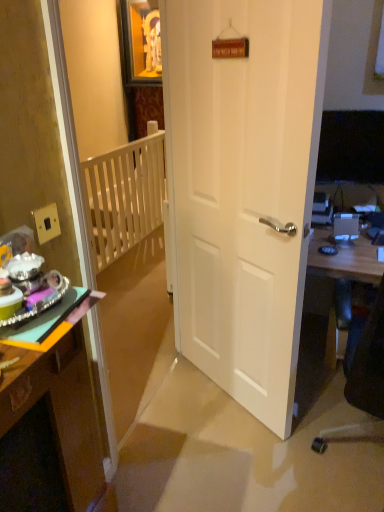
You are a GUI agent. You are given a task and a screenshot of the screen. Output one action in this format:
    pyautogui.click(x=<x>, y=<y>)
    Task: Click on the white matte door at center
    
    Given the screenshot: What is the action you would take?
    pyautogui.click(x=243, y=188)

Find the location of `wooden desk at left`. wooden desk at left is located at coordinates (60, 403).

Describe the element at coordinates (129, 263) in the screenshot. I see `white wooden bunk bed at upper left` at that location.

The image size is (384, 512). In order to click on white matte door at center in this screenshot , I will do `click(243, 188)`.

Does white wooden bunk bed at upper left come in front of white matte door at center?

That is True.

From the image's perspective, is white wooden bunk bed at upper left located above or below white matte door at center?

Clearly, from the image's perspective, white wooden bunk bed at upper left is below white matte door at center.

Is white matte door at center located within white wooden bunk bed at upper left?

Actually, white matte door at center is outside white wooden bunk bed at upper left.

I want to click on door behind the white wooden bunk bed at upper left, so tap(243, 188).

Consider the image. Is white matte door at center to the right of wooden desk at right from the viewer's perspective?

No.

Is white matte door at center looking in the opposite direction of wooden desk at right?

Correct, white matte door at center is looking away from wooden desk at right.

Who is taller, white matte door at center or wooden desk at right?

Standing taller between the two is white matte door at center.

In the image, is white matte door at center positioned in front of or behind wooden desk at right?

white matte door at center is in front of wooden desk at right.

Is wooden desk at right positioned with its back to white matte door at center?

No, white matte door at center is not at the back of wooden desk at right.

The width and height of the screenshot is (384, 512). In order to click on door above the wooden desk at right (from a real-world perspective) in this screenshot , I will do `click(243, 188)`.

Does wooden desk at right lie in front of white matte door at center?

That is False.

Does white wooden bunk bed at upper left lie behind wooden desk at left?

Yes, white wooden bunk bed at upper left is further from the viewer.

The width and height of the screenshot is (384, 512). Find the location of `bunk bed above the wooden desk at left (from a real-world perspective)`. bunk bed above the wooden desk at left (from a real-world perspective) is located at coordinates (129, 263).

Is white wooden bunk bed at upper left far from wooden desk at left?

Yes.

Does white wooden balustrade at left touch white matte door at center?

white wooden balustrade at left is not next to white matte door at center, and they're not touching.

Is white wooden balustrade at left in front of or behind white matte door at center in the image?

white wooden balustrade at left is positioned farther from the viewer than white matte door at center.

From the picture: From a real-world perspective, which is physically below, wooden desk at left or white wooden balustrade at left?

white wooden balustrade at left is physically lower.

Is wooden desk at left turned away from white wooden balustrade at left?

That's not correct — wooden desk at left is not looking away from white wooden balustrade at left.

Which is closer, (83, 503) or (156, 222)?

Clearly, point (83, 503) is closer to the camera than point (156, 222).

Is wooden desk at left placed right next to white wooden balustrade at left?

No, wooden desk at left is not in contact with white wooden balustrade at left.

Considering the relative sizes of white wooden balustrade at left and wooden desk at right in the image provided, is white wooden balustrade at left smaller than wooden desk at right?

Yes, white wooden balustrade at left is smaller than wooden desk at right.

Based on the photo, is the position of white wooden balustrade at left more distant than that of wooden desk at right?

That is True.

Does white wooden balustrade at left have a lesser height compared to wooden desk at right?

No, white wooden balustrade at left is not shorter than wooden desk at right.

Considering the relative sizes of white wooden balustrade at left and wooden desk at right in the image provided, is white wooden balustrade at left wider than wooden desk at right?

No, white wooden balustrade at left is not wider than wooden desk at right.

Find the location of a particular element. bunk bed lying on the left of white matte door at center is located at coordinates (129, 263).

Locate an element on the screen. table on the right of white matte door at center is located at coordinates (345, 259).

From the image, which object appears to be nearer to white matte door at center, white wooden bunk bed at upper left or wooden desk at right?

Among the two, wooden desk at right is located nearer to white matte door at center.

When comparing their distances from wooden desk at right, does white wooden bunk bed at upper left or white matte door at center seem closer?

Based on the image, white matte door at center appears to be nearer to wooden desk at right.

When comparing their distances from white wooden bunk bed at upper left, does white wooden balustrade at left or wooden desk at left seem closer?

white wooden balustrade at left.

Looking at the image, which one is located further to white matte door at center, wooden desk at left or white wooden bunk bed at upper left?

white wooden bunk bed at upper left.

Considering their positions, is white wooden balustrade at left positioned closer to wooden desk at right than wooden desk at left?

Among the two, wooden desk at left is located nearer to wooden desk at right.

Based on the photo, which object lies further to the anchor point white wooden bunk bed at upper left, white wooden balustrade at left or wooden desk at right?

Based on the image, wooden desk at right appears to be further to white wooden bunk bed at upper left.

Considering their positions, is white matte door at center positioned further to white wooden bunk bed at upper left than wooden desk at right?

wooden desk at right lies further to white wooden bunk bed at upper left than the other object.

From the image, which object appears to be nearer to white wooden bunk bed at upper left, white matte door at center or wooden desk at left?

white matte door at center is positioned closer to the anchor white wooden bunk bed at upper left.

Where is `bunk bed located between wooden desk at left and wooden desk at right in the left-right direction`? The height and width of the screenshot is (512, 384). bunk bed located between wooden desk at left and wooden desk at right in the left-right direction is located at coordinates [129, 263].

At what (x,y) coordinates should I click in order to perform the action: click on bunk bed between white matte door at center and wooden desk at left in the up-down direction. Please return your answer as a coordinate pair (x, y). The height and width of the screenshot is (512, 384). Looking at the image, I should click on (129, 263).

Locate an element on the screen. door between white wooden bunk bed at upper left and wooden desk at right is located at coordinates (243, 188).

This screenshot has height=512, width=384. I want to click on table located between white matte door at center and white wooden balustrade at left in the depth direction, so click(345, 259).